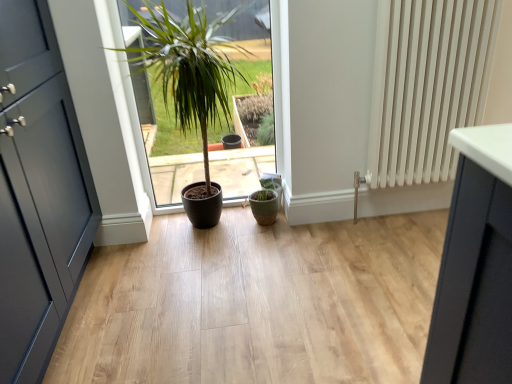
The width and height of the screenshot is (512, 384). What are the coordinates of `free spot in front of matte brown pot at center` in the screenshot? It's located at (204, 284).